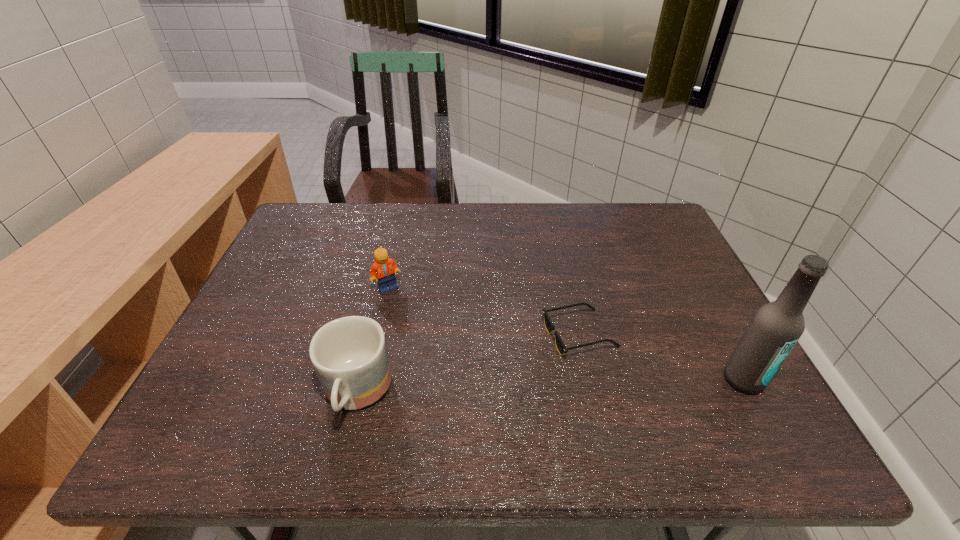
Where is `mug`? The width and height of the screenshot is (960, 540). mug is located at coordinates (349, 354).

Locate an element on the screen. Image resolution: width=960 pixels, height=540 pixels. beer bottle is located at coordinates (775, 328).

You are a GUI agent. You are given a task and a screenshot of the screen. Output one action in this format:
    pyautogui.click(x=<x>, y=<y>)
    Task: Click on the tallest object
    The width and height of the screenshot is (960, 540).
    Given the screenshot: What is the action you would take?
    pyautogui.click(x=775, y=328)

This screenshot has height=540, width=960. What are the coordinates of `Lego` in the screenshot? It's located at (385, 268).

Find the location of a particular element. Image resolution: width=960 pixels, height=540 pixels. the second object from right to left is located at coordinates (561, 347).

The image size is (960, 540). In order to click on sunglasses in this screenshot , I will do `click(561, 347)`.

Identify the location of vacant space located on the front-facing side of the farthest object. Image resolution: width=960 pixels, height=540 pixels. (419, 307).

Image resolution: width=960 pixels, height=540 pixels. In order to click on vacant space located on the front-facing side of the farthest object in this screenshot , I will do `click(456, 332)`.

I want to click on vacant space situated on the front-facing side of the farthest object, so click(479, 346).

You are a GUI agent. You are given a task and a screenshot of the screen. Output one action in this format:
    pyautogui.click(x=<x>, y=<y>)
    Task: Click on the free space located on the lenses of the third object from left to right
    
    Given the screenshot: What is the action you would take?
    pyautogui.click(x=500, y=401)